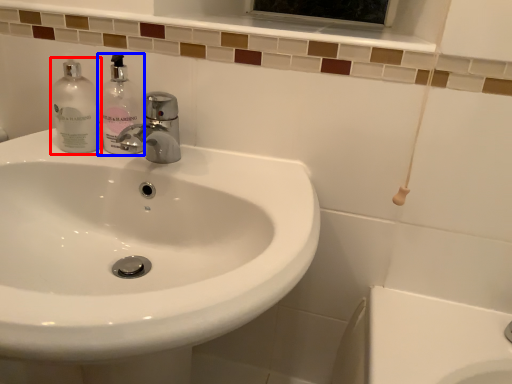
Question: Among these objects, which one is farthest to the camera, cleaning product (highlighted by a red box) or soap dispenser (highlighted by a blue box)?

Choices:
 (A) cleaning product
 (B) soap dispenser

Answer: (A)